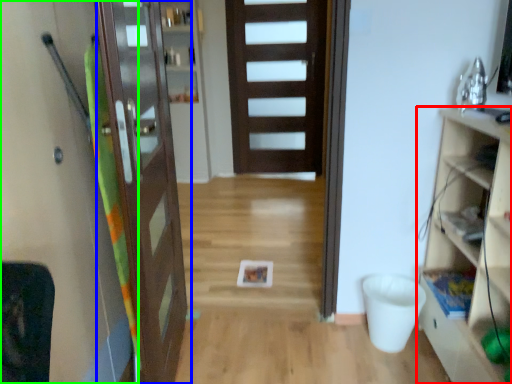
Question: Based on their relative distances, which object is farther from cabinetry (highlighted by a red box)? Choose from door (highlighted by a blue box) and screen door (highlighted by a green box).

Choices:
 (A) door
 (B) screen door

Answer: (B)